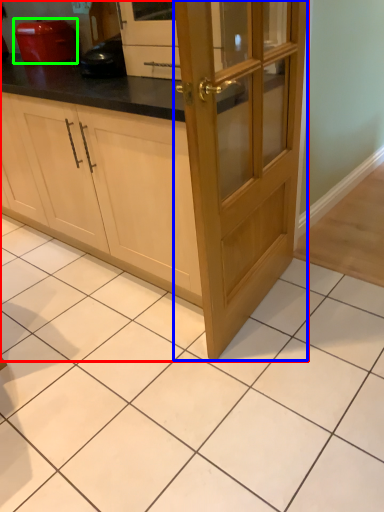
Question: Based on their relative distances, which object is farther from cabinetry (highlighted by a red box)? Choose from door (highlighted by a blue box) and home appliance (highlighted by a green box).

Choices:
 (A) door
 (B) home appliance

Answer: (B)